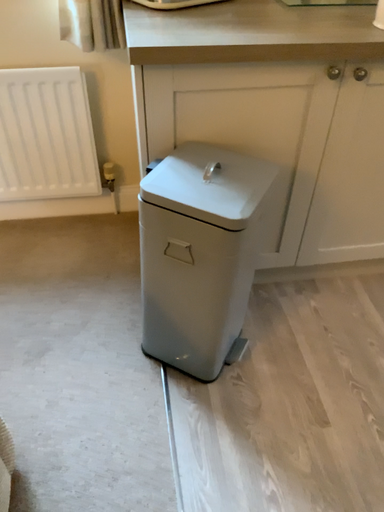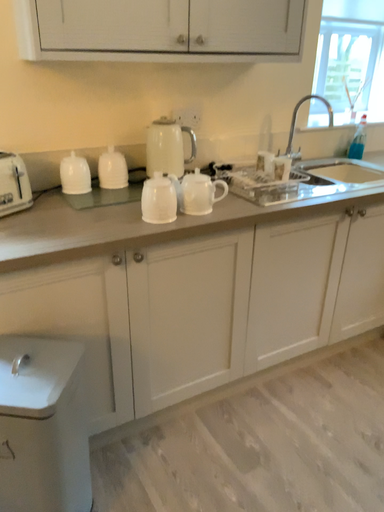
Question: Which way did the camera rotate in the video?

Choices:
 (A) rotated downward
 (B) rotated upward

Answer: (B)